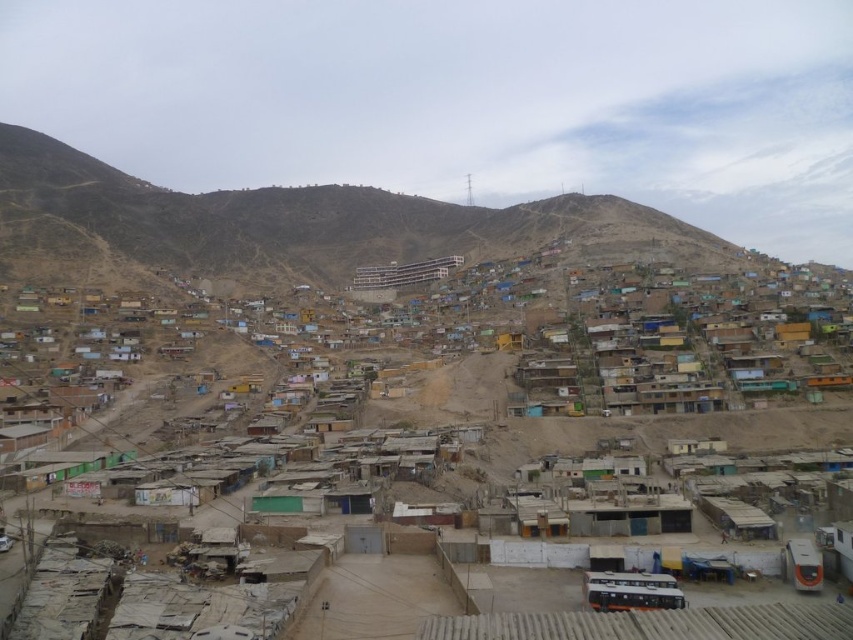
Who is more distant from viewer, (697,490) or (351,246)?

The point (351,246) is more distant.

Can you confirm if rustic adobe houses at center is smaller than dull brown hillside at upper center?

Correct, rustic adobe houses at center occupies less space than dull brown hillside at upper center.

Is point (631, 484) farther from viewer compared to point (432, 216)?

No, (631, 484) is in front of (432, 216).

The height and width of the screenshot is (640, 853). Find the location of `rustic adobe houses at center`. rustic adobe houses at center is located at coordinates click(x=590, y=417).